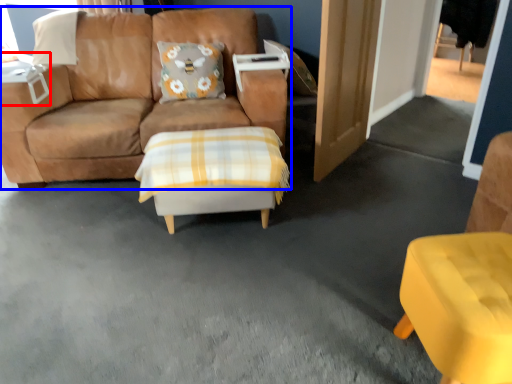
Question: Among these objects, which one is farthest to the camera, table (highlighted by a red box) or studio couch (highlighted by a blue box)?

Choices:
 (A) table
 (B) studio couch

Answer: (A)